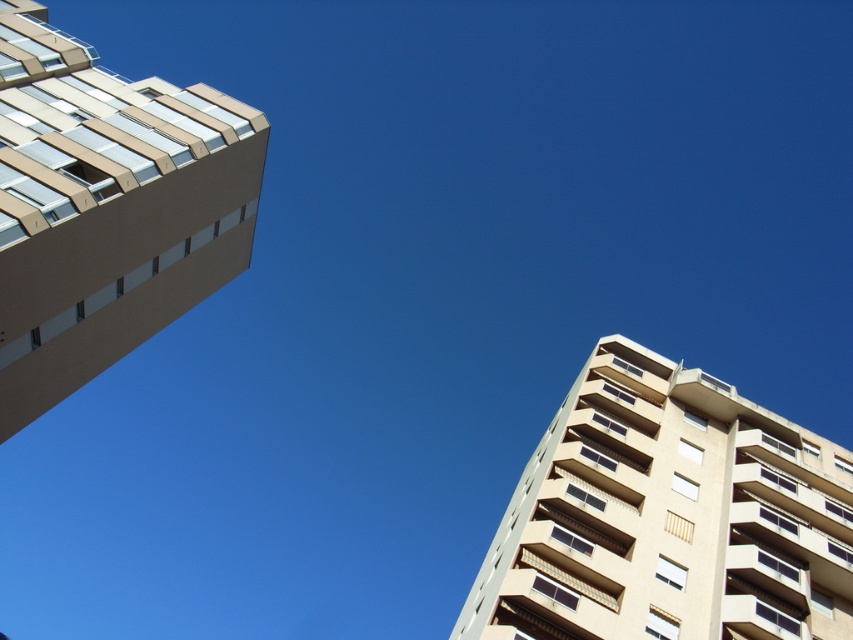
Question: Is beige concrete building at right closer to camera compared to beige concrete building at left?

Choices:
 (A) yes
 (B) no

Answer: (B)

Question: Can you confirm if beige concrete building at right is bigger than beige concrete building at left?

Choices:
 (A) no
 (B) yes

Answer: (B)

Question: Does beige concrete building at right have a larger size compared to beige concrete building at left?

Choices:
 (A) yes
 (B) no

Answer: (A)

Question: Which point is farther to the camera?

Choices:
 (A) beige concrete building at right
 (B) beige concrete building at left

Answer: (A)

Question: Which object appears farthest from the camera in this image?

Choices:
 (A) beige concrete building at right
 (B) beige concrete building at left

Answer: (A)